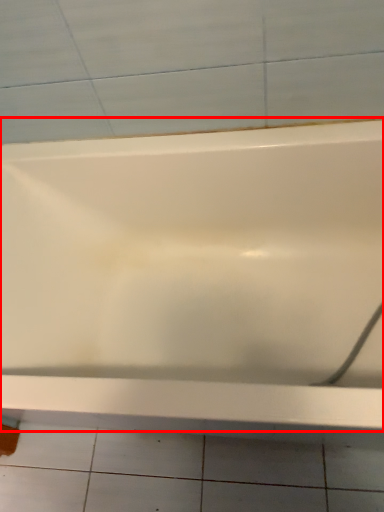
Question: From the image's perspective, considering the relative positions of bathtub (annotated by the red box) and ceramic tile in the image provided, where is bathtub (annotated by the red box) located with respect to the staircase?

Choices:
 (A) below
 (B) above

Answer: (B)